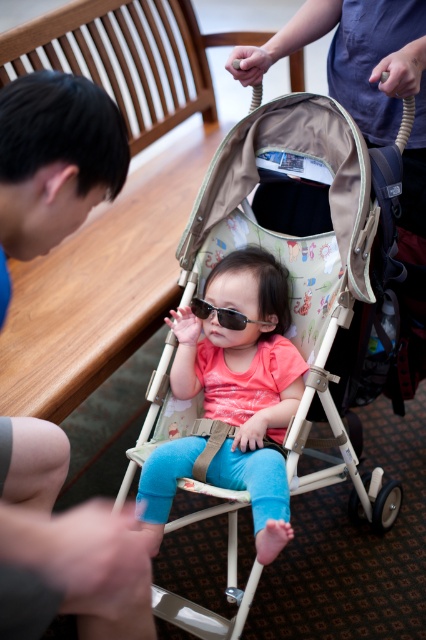
Between beige fabric baby carriage at center and blue fabric shirt at left, which one is positioned higher?

blue fabric shirt at left is above.

Does beige fabric baby carriage at center appear over blue fabric shirt at left?

Actually, beige fabric baby carriage at center is below blue fabric shirt at left.

Where is `beige fabric baby carriage at center`? The width and height of the screenshot is (426, 640). beige fabric baby carriage at center is located at coordinates (299, 264).

Can you confirm if beige fabric baby carriage at center is taller than matte pink shirt at center?

Yes, beige fabric baby carriage at center is taller than matte pink shirt at center.

Between point (368, 230) and point (206, 289), which one is positioned in front?

Point (368, 230) is in front.

Describe the element at coordinates (299, 264) in the screenshot. I see `beige fabric baby carriage at center` at that location.

Locate an element on the screen. The image size is (426, 640). beige fabric baby carriage at center is located at coordinates (299, 264).

Who is shorter, matte pink shirt at center or sunglasses at center?

Standing shorter between the two is sunglasses at center.

Is matte pink shirt at center positioned at the back of sunglasses at center?

No.

Between point (256, 257) and point (199, 308), which one is positioned in front?

Point (199, 308) is in front.

Locate an element on the screen. The width and height of the screenshot is (426, 640). matte pink shirt at center is located at coordinates (244, 381).